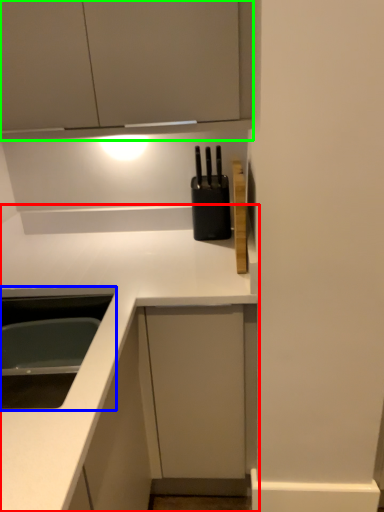
Question: Considering the real-world distances, which object is closest to countertop (highlighted by a red box)? sink (highlighted by a blue box) or cabinetry (highlighted by a green box).

Choices:
 (A) sink
 (B) cabinetry

Answer: (A)